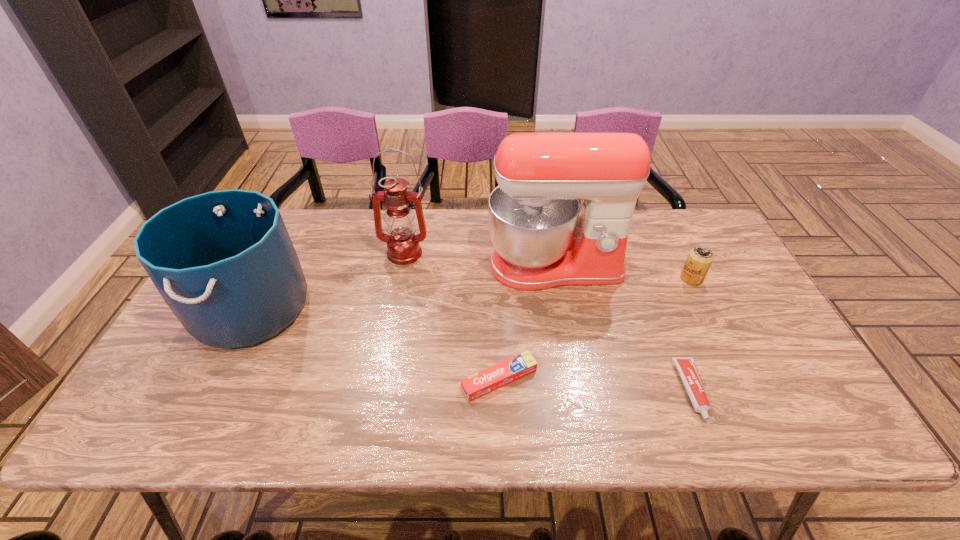
Identify which object is the second nearest to the leftmost object. Please provide its 2D coordinates. Your answer should be formatted as a tuple, i.e. [(x, y)], where the tuple contains the x and y coordinates of a point satisfying the conditions above.

[(486, 381)]

Locate an element on the screen. This screenshot has height=540, width=960. free space in the image that satisfies the following two spatial constraints: 1. on the front side of the third tallest object; 2. on the right side of the left toothpaste is located at coordinates (216, 380).

Identify the location of free space that satisfies the following two spatial constraints: 1. on the front-facing side of the mixer; 2. on the right side of the beer can. The height and width of the screenshot is (540, 960). (557, 279).

You are a GUI agent. You are given a task and a screenshot of the screen. Output one action in this format:
    pyautogui.click(x=<x>, y=<y>)
    Task: Click on the free space that satisfies the following two spatial constraints: 1. on the front-facing side of the beer can; 2. on the left side of the mixer
    The height and width of the screenshot is (540, 960).
    Given the screenshot: What is the action you would take?
    pyautogui.click(x=557, y=279)